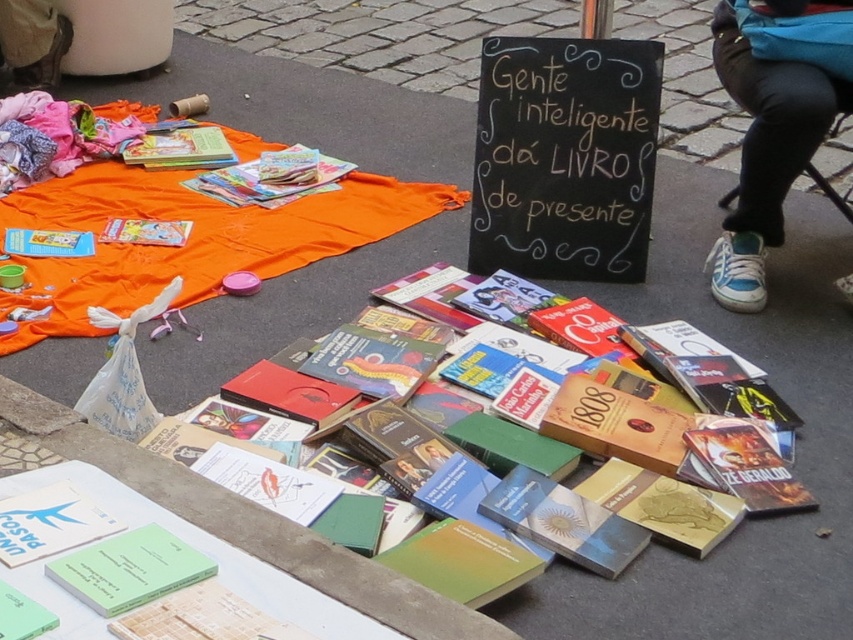
Question: Among these objects, which one is nearest to the camera?

Choices:
 (A) hardcover book at center
 (B) blue canvas shoe at lower right
 (C) black chalkboard at center

Answer: (A)

Question: In this image, where is hardcover book at center located relative to blue canvas shoe at lower right?

Choices:
 (A) right
 (B) left

Answer: (B)

Question: Is hardcover book at center below blue canvas shoe at lower right?

Choices:
 (A) yes
 (B) no

Answer: (A)

Question: Is hardcover book at center to the left of green paper book at lower center from the viewer's perspective?

Choices:
 (A) yes
 (B) no

Answer: (B)

Question: Among these points, which one is farthest from the camera?

Choices:
 (A) (572, 115)
 (B) (682, 419)
 (C) (109, 170)
 (D) (70, 582)

Answer: (C)

Question: Estimate the real-world distances between objects in this image. Which object is closer to the black chalkboard at center?

Choices:
 (A) orange fabric at upper left
 (B) green paper book at lower center
 (C) hardcover book at center

Answer: (A)